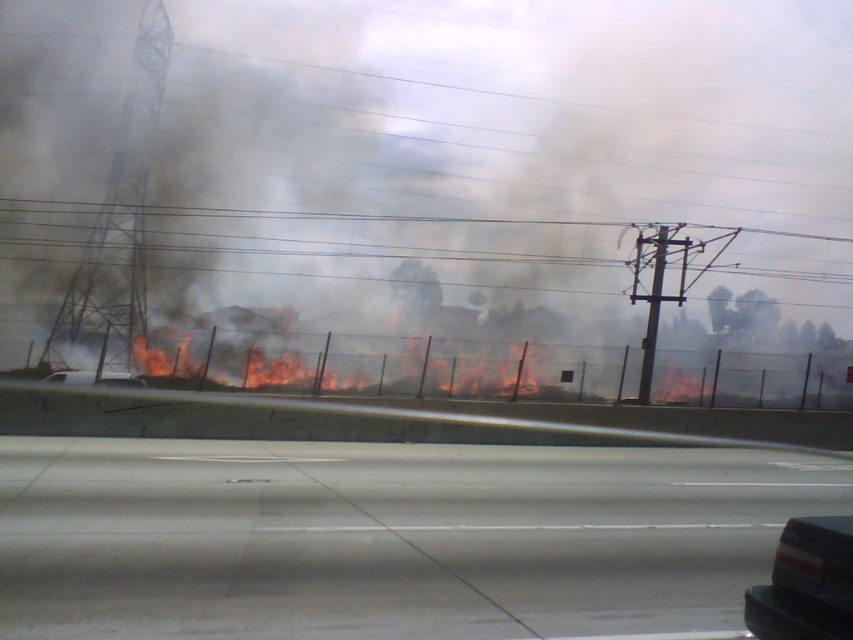
You are a passenger in a car and want to exit through the nearest available exit. You see the black glossy car at lower right and the black matte car at lower center in front of you. Which car is closer to you so you can decide the nearest path?

The black glossy car at lower right is closer to the viewer than the black matte car at lower center, so the nearest path would be near the black glossy car at lower right.

You are a passenger in a vehicle and notice the black glossy car at lower right. Based on its position, can you estimate how close it is to the fire scene?

The black glossy car at lower right is located at point (805, 582), which is relatively close to the fire scene, so it might be in potential danger.